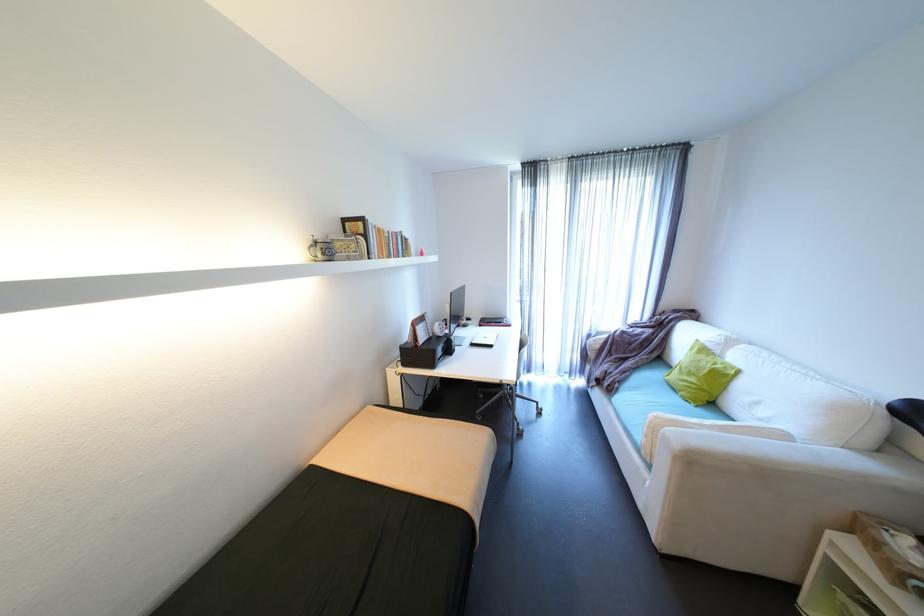
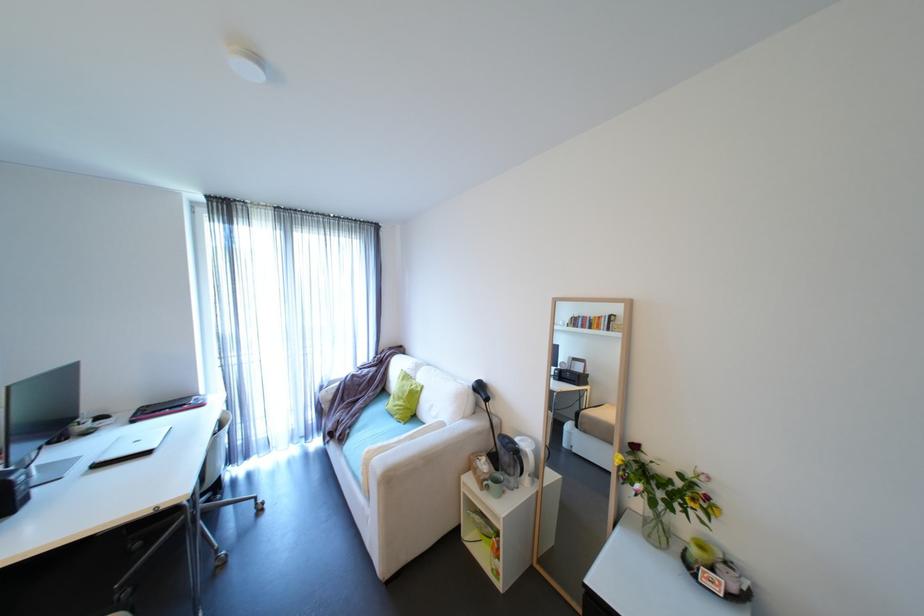
Where in the second image is the point corresponding to (x=794, y=437) from the first image?

(450, 424)